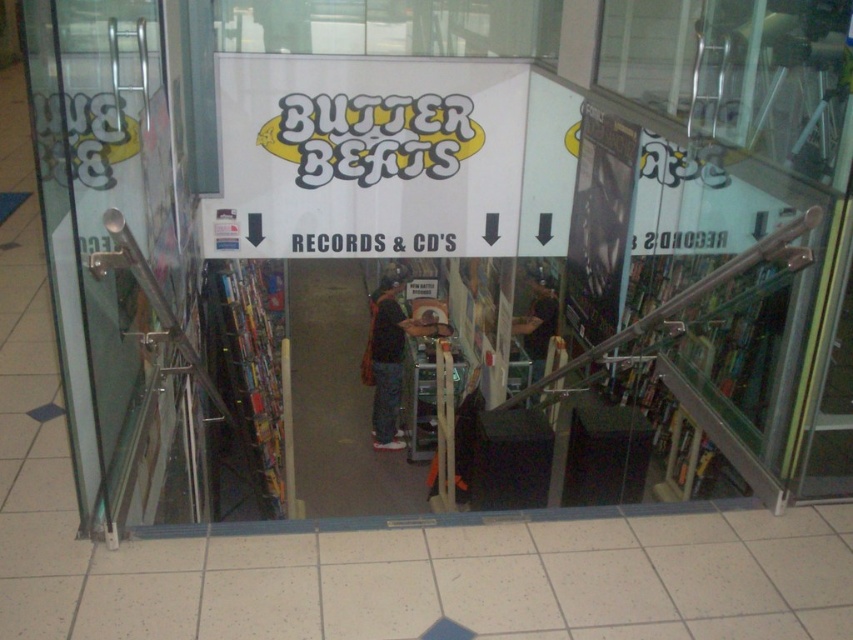
You are standing in front of the entrance to Butter Beats music store. You need to locate the transparent glass door at left. According to the store layout, where exactly is it positioned? Please provide coordinates in the format of a point like this example format of point coordinates.

The transparent glass door at left is positioned at point coordinates of point (99,209).

You are standing at the entrance of Butter Beats music store. There are two points marked on the floor inside the store. One is at point (152, 227) and the other at point (305, 392). If you face the direction the arrows on the sign point, which point is closer to you?

Point 0.359, 0.179 is in front of point (305, 392), so if you face the direction the arrows point, point (152, 227) is closer to you.

You are a delivery person trying to enter the Butter Beats music store. You have a large package that is 2 meters tall. The store entrance has a transparent glass door at left and a dark gray carpet at center. Can you fit through the entrance without bending down?

The transparent glass door at left is not as tall as dark gray carpet at center. Since the door is shorter, the 2 meter tall package may not fit through without bending or adjusting, but the exact height isn not specified. However, since the door is shorter than the carpet area, it might be too low. Without specific measurements, it is uncertain. But according to the description, the door is shorter so likely too short for the package.